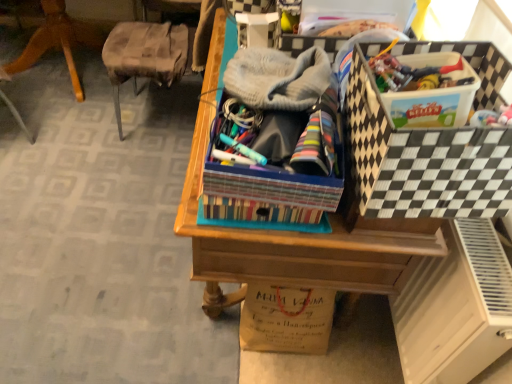
Question: From the image's perspective, is wooden desk at center above or below gray knitted hat at center?

Choices:
 (A) above
 (B) below

Answer: (B)

Question: Visually, is wooden desk at center positioned to the left or to the right of gray knitted hat at center?

Choices:
 (A) left
 (B) right

Answer: (B)

Question: Estimate the real-world distances between objects in this image. Which object is closer to the brown paper bag at lower center?

Choices:
 (A) white matte file cabinet at lower right
 (B) wooden desk at center
 (C) gray knitted hat at center
 (D) black and white checkered storage box at upper right
 (E) wooden chair at left

Answer: (B)

Question: Considering the real-world distances, which object is farthest from the black and white checkered storage box at upper right?

Choices:
 (A) gray knitted hat at center
 (B) white matte file cabinet at lower right
 (C) wooden desk at center
 (D) brown paper bag at lower center
 (E) wooden chair at left

Answer: (E)